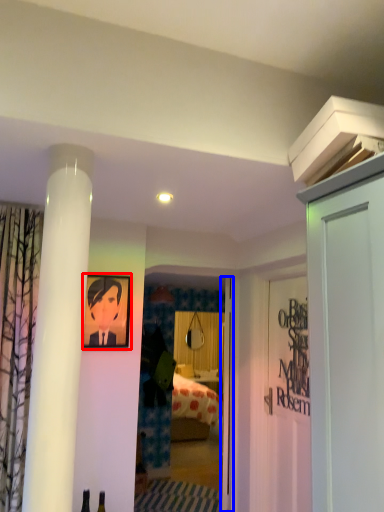
Question: Among these objects, which one is farthest to the camera, picture frame (highlighted by a red box) or door (highlighted by a blue box)?

Choices:
 (A) picture frame
 (B) door

Answer: (B)